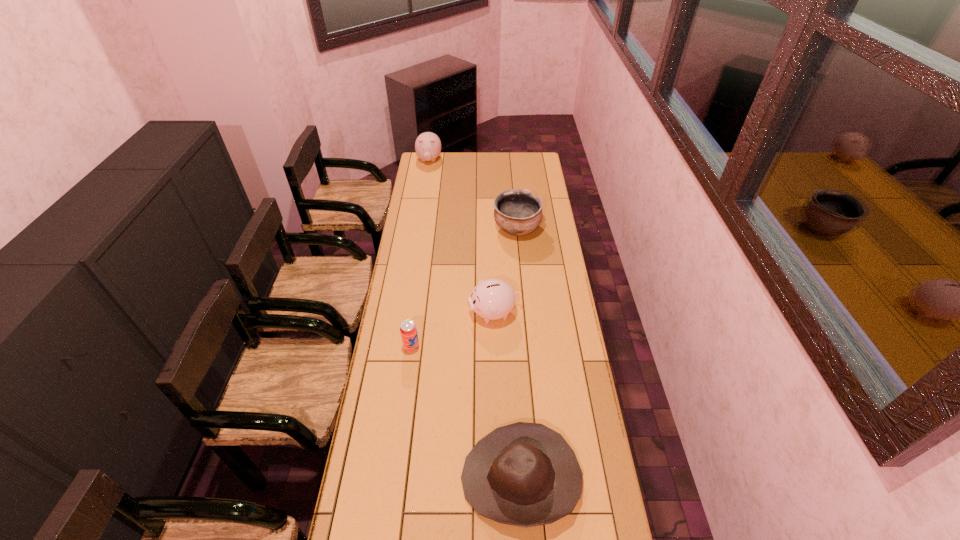
Image resolution: width=960 pixels, height=540 pixels. What are the coordinates of `the left piggy bank` in the screenshot? It's located at (428, 145).

What are the coordinates of `the farther piggy bank` in the screenshot? It's located at (428, 145).

At what (x,y) coordinates should I click in order to perform the action: click on the right piggy bank. Please return your answer as a coordinate pair (x, y). The height and width of the screenshot is (540, 960). Looking at the image, I should click on (492, 299).

The width and height of the screenshot is (960, 540). Find the location of `the nearer piggy bank`. the nearer piggy bank is located at coordinates (492, 299).

The height and width of the screenshot is (540, 960). In order to click on the fourth nearest object in this screenshot , I will do `click(517, 212)`.

You are a GUI agent. You are given a task and a screenshot of the screen. Output one action in this format:
    pyautogui.click(x=<x>, y=<y>)
    Task: Click on the fourth farthest object
    This screenshot has width=960, height=540.
    Given the screenshot: What is the action you would take?
    pyautogui.click(x=408, y=330)

Image resolution: width=960 pixels, height=540 pixels. Find the location of `the nearest object`. the nearest object is located at coordinates (523, 474).

Find the location of a particular element. vacant position located at the snout of the farthest object is located at coordinates (425, 185).

In order to click on free region located 0.120m on the left of the right piggy bank in this screenshot , I will do `click(440, 313)`.

Where is `blank space located on the left of the pottery`? The image size is (960, 540). blank space located on the left of the pottery is located at coordinates (448, 229).